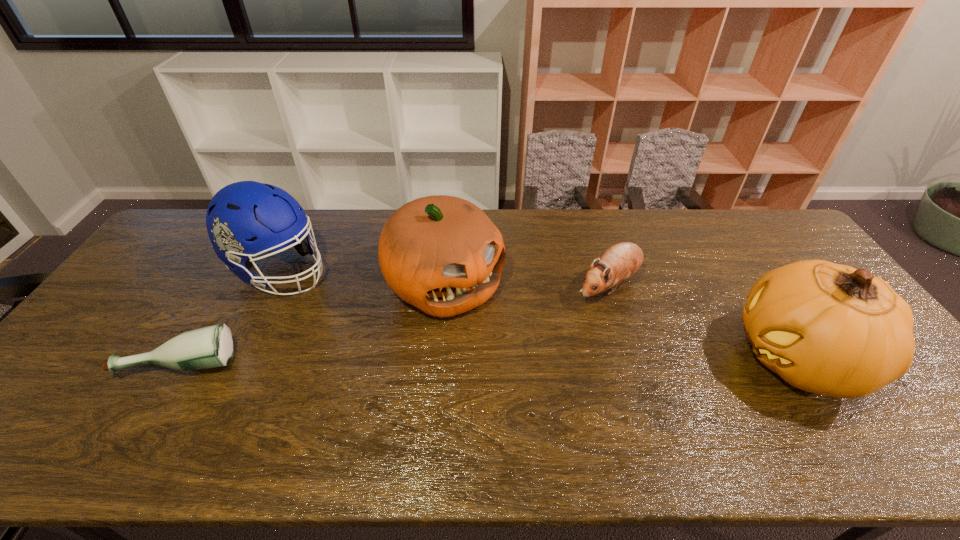
Locate an element on the screen. vacant space on the desktop that is between the shortest object and the right pumpkin and is positioned on the face of the third object from left to right is located at coordinates (527, 360).

Locate an element on the screen. vacant spot on the desktop that is between the bottle and the right pumpkin and is positioned at the face of the second object from right to left is located at coordinates (478, 360).

You are a GUI agent. You are given a task and a screenshot of the screen. Output one action in this format:
    pyautogui.click(x=<x>, y=<y>)
    Task: Click on the free space on the desktop that is between the shortest object and the rightmost object and is positioned on the face guard of the football helmet
    
    Given the screenshot: What is the action you would take?
    pyautogui.click(x=461, y=360)